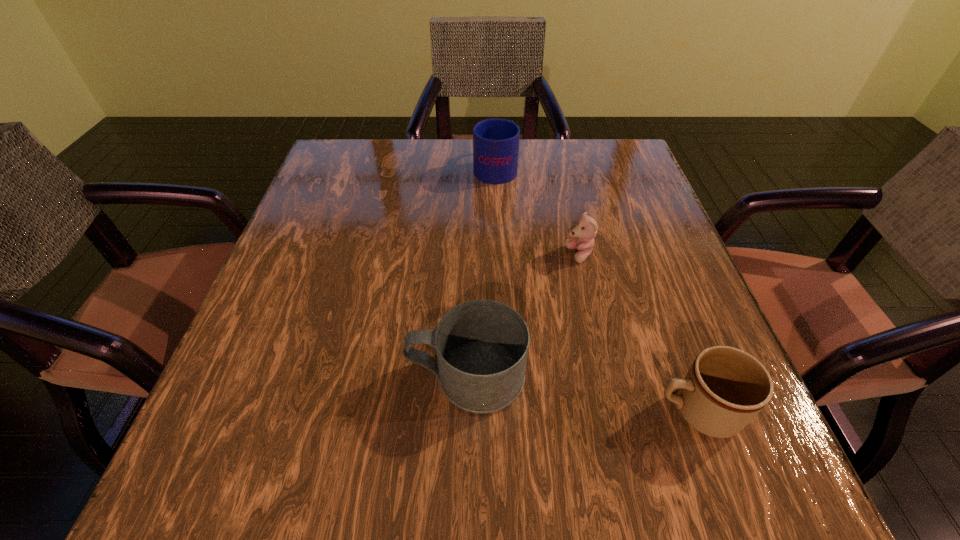
Find the location of a particular element. object positioned at the far edge is located at coordinates (495, 141).

Where is `object located in the near edge section of the desktop`? object located in the near edge section of the desktop is located at coordinates (725, 388).

The width and height of the screenshot is (960, 540). I want to click on object present at the right edge, so click(x=725, y=388).

Where is `object present at the near right corner`? This screenshot has width=960, height=540. object present at the near right corner is located at coordinates (725, 388).

I want to click on vacant space at the far edge of the desktop, so click(530, 147).

This screenshot has height=540, width=960. What are the coordinates of `vacant space at the near edge of the desktop` in the screenshot? It's located at (396, 442).

In the image, there is a desktop. Where is `vacant space at the left edge`? The height and width of the screenshot is (540, 960). vacant space at the left edge is located at coordinates (333, 339).

Identify the location of free point at the right edge. Image resolution: width=960 pixels, height=540 pixels. (644, 211).

Identify the location of vacant space at the far left corner of the desktop. This screenshot has height=540, width=960. (377, 146).

Identify the location of vacant space at the near left corner. This screenshot has width=960, height=540. (265, 507).